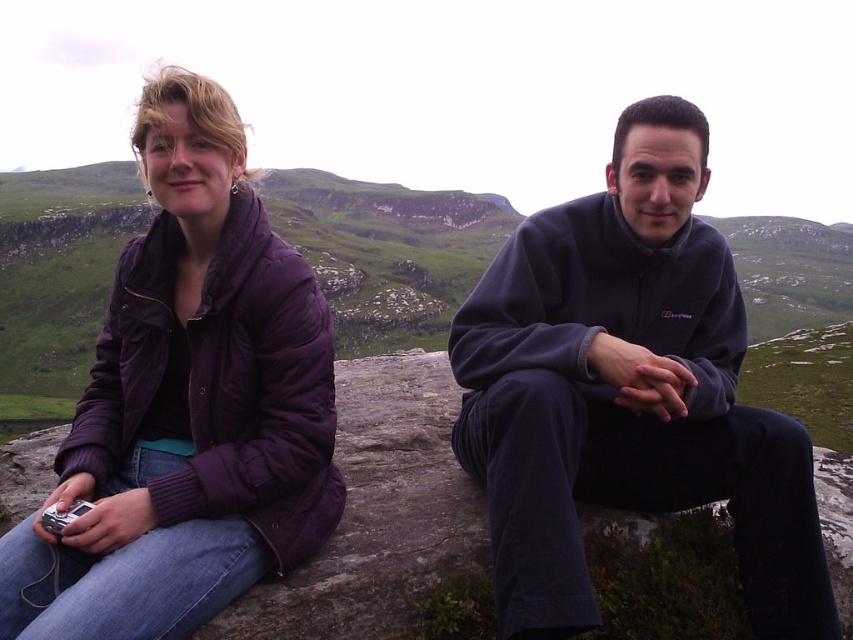
Between point (488, 320) and point (228, 269), which one is positioned in front?

Point (228, 269) is in front.

Can you confirm if dark gray fleece at center is smaller than purple puffy jacket at left?

Incorrect, dark gray fleece at center is not smaller in size than purple puffy jacket at left.

Which is in front, point (477, 333) or point (152, 266)?

Positioned in front is point (152, 266).

Locate an element on the screen. Image resolution: width=853 pixels, height=640 pixels. dark gray fleece at center is located at coordinates (628, 392).